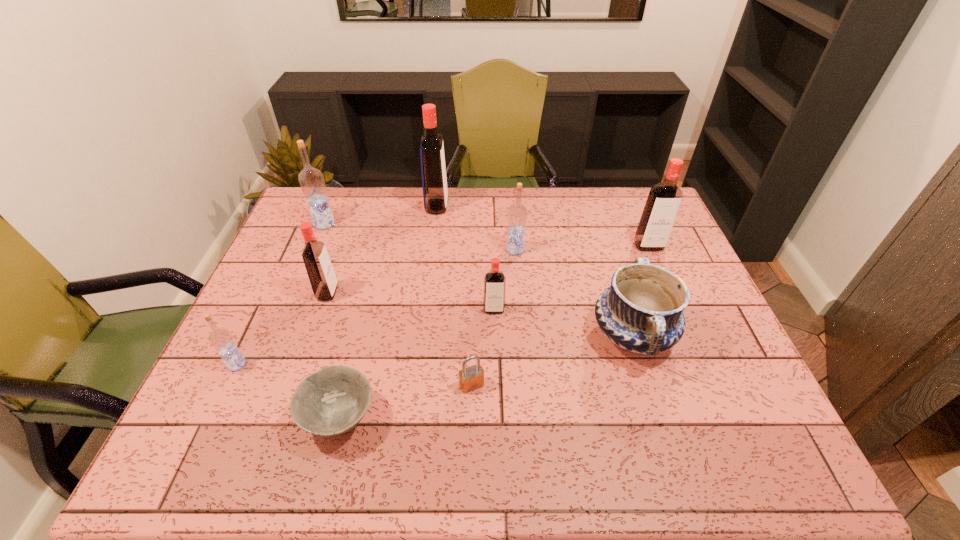
Identify the location of pottery situated at the right edge. click(642, 311).

Where is `object that is at the far left corner`? object that is at the far left corner is located at coordinates (311, 180).

In the image, there is a desktop. In order to click on vacant space at the far edge in this screenshot , I will do `click(396, 195)`.

Locate an element on the screen. free space at the left edge of the desktop is located at coordinates (271, 300).

The image size is (960, 540). Identify the location of blank area at the right edge. (690, 274).

Locate an element on the screen. free space at the far left corner of the desktop is located at coordinates (345, 188).

This screenshot has height=540, width=960. Find the location of `free location at the near left corner`. free location at the near left corner is located at coordinates (190, 461).

Find the location of a particular element. The width and height of the screenshot is (960, 540). vacant space at the far right corner of the desktop is located at coordinates (624, 202).

Find the location of `free point between the ninth tallest object and the shortest object`. free point between the ninth tallest object and the shortest object is located at coordinates click(x=406, y=401).

Find the location of a particular element. This screenshot has width=960, height=540. free space between the shortest object and the blue pottery is located at coordinates (486, 376).